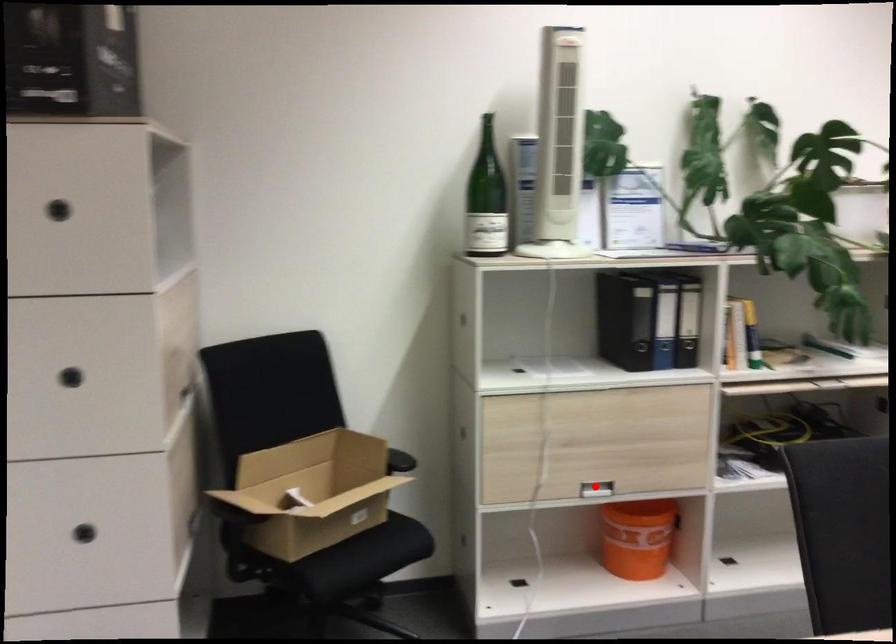
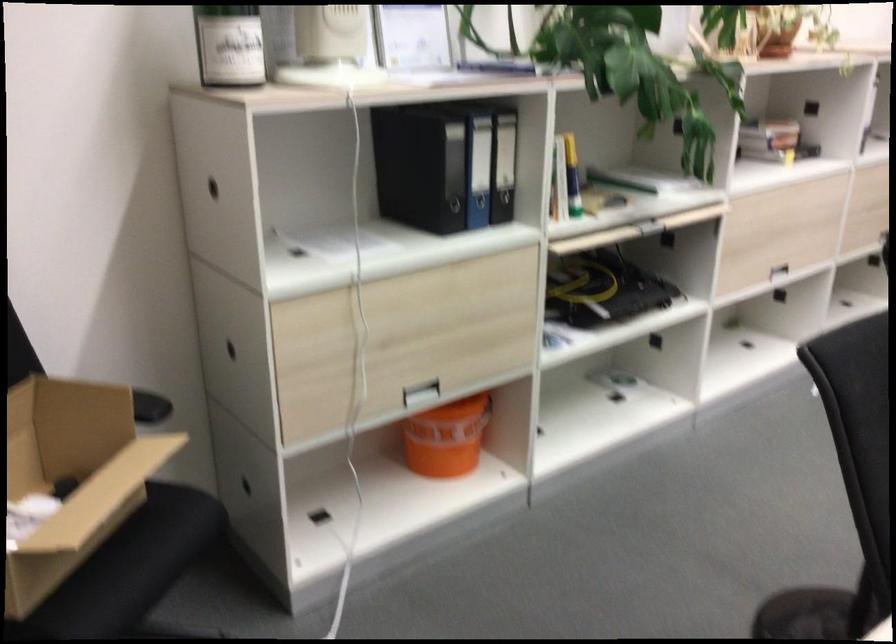
Question: I am providing you with two images of the same scene from different viewpoints. Image1 has a red point marked. In image2, the corresponding 3D location appears at what relative position? Reply with the corresponding letter.

Choices:
 (A) Closer
 (B) Farther

Answer: (A)